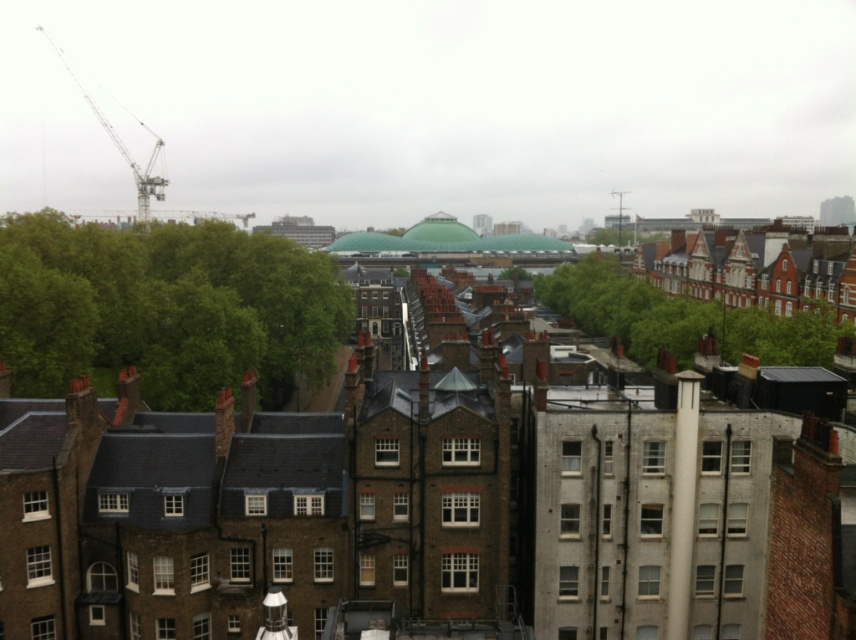
Is the position of green leafy tree at left more distant than that of green leafy tree at center?

No, it is in front of green leafy tree at center.

Can you confirm if green leafy tree at left is wider than green leafy tree at center?

Yes, green leafy tree at left is wider than green leafy tree at center.

Between point (284, 358) and point (604, 292), which one is positioned in front?

Positioned in front is point (284, 358).

What are the coordinates of `green leafy tree at left` in the screenshot? It's located at (165, 307).

Between green leafy tree at center and metallic silver crane at upper left, which one is positioned higher?

metallic silver crane at upper left

Is green leafy tree at center positioned behind metallic silver crane at upper left?

No, it is not.

Measure the distance between point (x=605, y=289) and camera.

Point (x=605, y=289) is 575.55 feet away from camera.

The width and height of the screenshot is (856, 640). What are the coordinates of `green leafy tree at center` in the screenshot? It's located at (682, 317).

Find the location of a particular element. The height and width of the screenshot is (640, 856). green leafy tree at left is located at coordinates (165, 307).

This screenshot has width=856, height=640. Find the location of `green leafy tree at left`. green leafy tree at left is located at coordinates (165, 307).